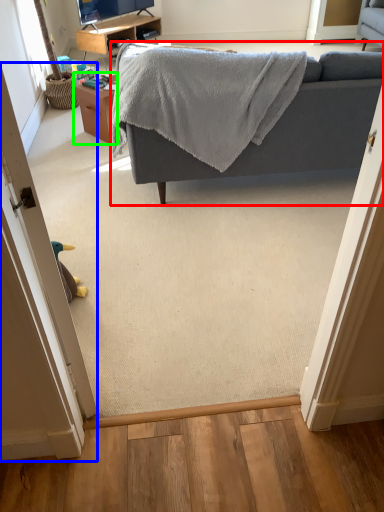
Question: Considering the real-world distances, which object is farthest from studio couch (highlighted by a red box)? door (highlighted by a blue box) or table (highlighted by a green box)?

Choices:
 (A) door
 (B) table

Answer: (A)